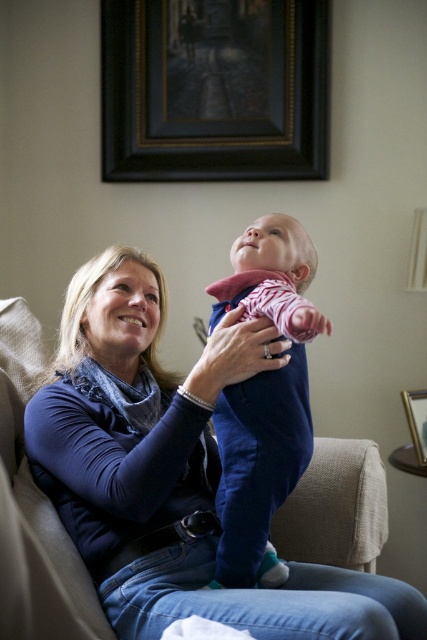
You are a photographer setting up for a family photo shoot. You want to ensure that the blue fleece sweater at upper left is in focus while capturing the woman and baby in the foreground. Given that your camera has a depth of field that can sharply focus objects within 1 meter from the current focus point, where should you set the focus to include both the sweater and the subjects?

The blue fleece sweater at upper left is 1.16 meters from the camera. To include both it and the woman and baby in focus, set the focus point at 0.58 meters from the camera. This way, the sweater at 1.16 meters falls within the 1 meter depth of field range behind the focus point, and the subjects in the foreground are within the 1 meter range in front.